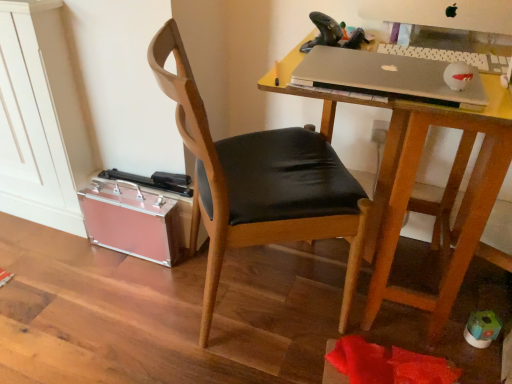
Where is `wooden chair at center`? The image size is (512, 384). wooden chair at center is located at coordinates (259, 183).

Measure the distance between wooden chair at center and camera.

A distance of 31.30 inches exists between wooden chair at center and camera.

This screenshot has width=512, height=384. Describe the element at coordinates (387, 77) in the screenshot. I see `silver metallic laptop at upper right` at that location.

Locate an element on the screen. Image resolution: width=512 pixels, height=384 pixels. wooden chair at center is located at coordinates (259, 183).

Looking at this image, is wooden desk at center surrounded by wooden chair at center?

That's incorrect, wooden desk at center is not inside wooden chair at center.

Is wooden chair at center positioned behind wooden desk at center?

Yes, wooden chair at center is behind wooden desk at center.

You are a GUI agent. You are given a task and a screenshot of the screen. Output one action in this format:
    pyautogui.click(x=<x>, y=<y>)
    Task: Click on the desk that is on the right side of wooden chair at center
    The height and width of the screenshot is (384, 512).
    Given the screenshot: What is the action you would take?
    pyautogui.click(x=414, y=182)

Looking at this image, which of these two, silver metallic laptop at upper right or wooden desk at center, stands taller?

wooden desk at center.

Would you say silver metallic laptop at upper right is a long distance from wooden desk at center?

No.

From a real-world perspective, is silver metallic laptop at upper right positioned over wooden desk at center based on gravity?

Yes, from a real-world perspective, silver metallic laptop at upper right is over wooden desk at center

From a real-world perspective, does silver metallic keyboard at upper right stand above wooden desk at center?

Yes, from a real-world perspective, silver metallic keyboard at upper right is above wooden desk at center.

In terms of width, does silver metallic keyboard at upper right look wider or thinner when compared to wooden desk at center?

In the image, silver metallic keyboard at upper right appears to be more narrow than wooden desk at center.

From the picture: Is silver metallic keyboard at upper right completely or partially outside of wooden desk at center?

No, silver metallic keyboard at upper right is not outside of wooden desk at center.

Looking at this image, can you confirm if silver metallic keyboard at upper right is smaller than wooden desk at center?

Yes.

How much distance is there between silver metallic laptop at upper right and wooden chair at center?

The distance of silver metallic laptop at upper right from wooden chair at center is 13.24 inches.

From the image's perspective, is silver metallic laptop at upper right above or below wooden chair at center?

silver metallic laptop at upper right is situated higher than wooden chair at center in the image.

Is point (351, 50) positioned in front of point (203, 158)?

No, it is not.

Is point (501, 154) positioned after point (258, 173)?

No, it is in front of (258, 173).

Looking at their sizes, would you say wooden desk at center is wider or thinner than wooden chair at center?

Considering their sizes, wooden desk at center looks broader than wooden chair at center.

Is wooden desk at center oriented towards wooden chair at center?

No, wooden desk at center does not turn towards wooden chair at center.

Is wooden desk at center not within wooden chair at center?

Yes, wooden desk at center is outside of wooden chair at center.

Is silver metallic keyboard at upper right bigger than silver metallic laptop at upper right?

No, silver metallic keyboard at upper right is not bigger than silver metallic laptop at upper right.

Which object is positioned more to the left, silver metallic keyboard at upper right or silver metallic laptop at upper right?

silver metallic laptop at upper right.

From the image's perspective, between silver metallic keyboard at upper right and silver metallic laptop at upper right, who is located below?

silver metallic laptop at upper right.

Is silver metallic keyboard at upper right next to silver metallic laptop at upper right?

silver metallic keyboard at upper right is not next to silver metallic laptop at upper right, and they're not touching.

Can you confirm if silver metallic laptop at upper right is wider than silver metallic keyboard at upper right?

Correct, the width of silver metallic laptop at upper right exceeds that of silver metallic keyboard at upper right.

Can you tell me how much silver metallic laptop at upper right and silver metallic keyboard at upper right differ in facing direction?

They differ by 0.00217 degrees in their facing directions.

Is there a large distance between silver metallic laptop at upper right and silver metallic keyboard at upper right?

Actually, silver metallic laptop at upper right and silver metallic keyboard at upper right are a little close together.

In order to click on laptop that is in front of the silver metallic keyboard at upper right in this screenshot , I will do `click(387, 77)`.

Image resolution: width=512 pixels, height=384 pixels. What are the coordinates of `chair above the wooden desk at center (from a real-world perspective)` in the screenshot? It's located at (259, 183).

Where is `desk below the silver metallic laptop at upper right (from the image's perspective)`? This screenshot has height=384, width=512. desk below the silver metallic laptop at upper right (from the image's perspective) is located at coordinates (414, 182).

From the image, which object appears to be farther from silver metallic keyboard at upper right, wooden desk at center or wooden chair at center?

wooden chair at center lies further to silver metallic keyboard at upper right than the other object.

Which object lies nearer to the anchor point wooden chair at center, silver metallic laptop at upper right or silver metallic keyboard at upper right?

silver metallic laptop at upper right is positioned closer to the anchor wooden chair at center.

Based on the photo, looking at the image, which one is located closer to wooden desk at center, silver metallic keyboard at upper right or silver metallic laptop at upper right?

Based on the image, silver metallic laptop at upper right appears to be nearer to wooden desk at center.

From the image, which object appears to be farther from wooden desk at center, wooden chair at center or silver metallic laptop at upper right?

wooden chair at center is further to wooden desk at center.

Looking at the image, which one is located closer to wooden chair at center, silver metallic laptop at upper right or wooden desk at center?

wooden desk at center lies closer to wooden chair at center than the other object.

Based on their spatial positions, is silver metallic laptop at upper right or wooden chair at center further from silver metallic keyboard at upper right?

wooden chair at center lies further to silver metallic keyboard at upper right than the other object.

Estimate the real-world distances between objects in this image. Which object is closer to silver metallic keyboard at upper right, silver metallic laptop at upper right or wooden desk at center?

silver metallic laptop at upper right lies closer to silver metallic keyboard at upper right than the other object.

Estimate the real-world distances between objects in this image. Which object is further from silver metallic keyboard at upper right, wooden chair at center or silver metallic laptop at upper right?

wooden chair at center.

Identify the location of laptop between wooden chair at center and wooden desk at center from left to right. This screenshot has height=384, width=512. (387, 77).

Identify the location of laptop between silver metallic keyboard at upper right and wooden desk at center in the up-down direction. (387, 77).

At what (x,y) coordinates should I click in order to perform the action: click on laptop situated between wooden chair at center and silver metallic keyboard at upper right from left to right. Please return your answer as a coordinate pair (x, y). This screenshot has width=512, height=384. Looking at the image, I should click on (387, 77).

Where is `desk between wooden chair at center and silver metallic keyboard at upper right`? This screenshot has width=512, height=384. desk between wooden chair at center and silver metallic keyboard at upper right is located at coordinates (414, 182).